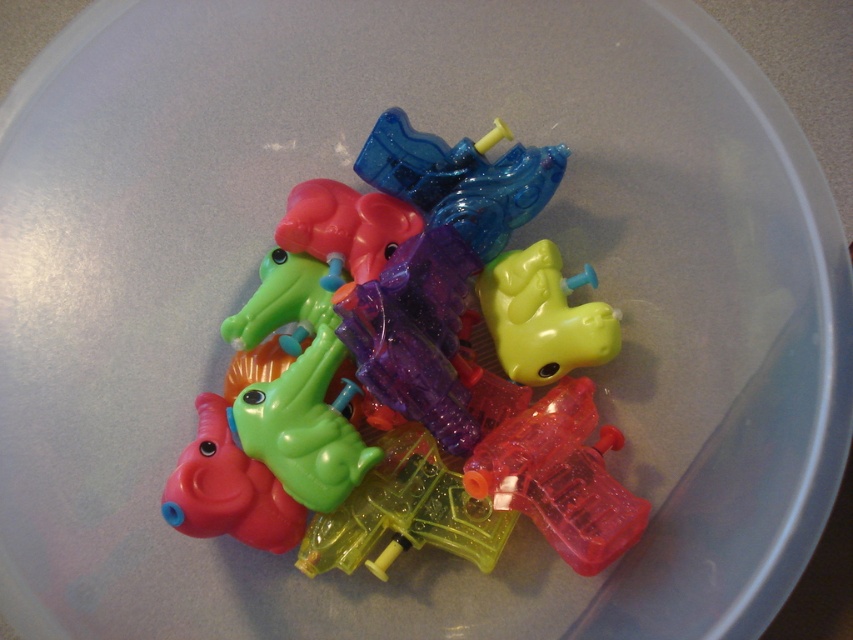
You have a small box that can only fit items up to 10 cm wide. You need to place either the translucent plastic toy at center or the transparent plastic gun at center inside it. Based on their sizes, which one can fit?

The transparent plastic gun at center can fit in the box since its width is smaller than the translucent plastic toy at center, and the box can hold items up to 10 cm wide.

You are a child who wants to reach the transparent plastic gun at center from where you are standing. The toys are arranged in a pile. Can you safely step over the pile of toys to reach the gun?

The distance between you and the transparent plastic gun at center is 1.22 meters. Since the pile of toys is part of the path, stepping over them might be possible if the child can manage the distance and height of the pile, but safety depends on the child maintaining balance and not tripping over the toys.

You have two toys in the center of a container, a translucent plastic toy at center and a rubberized green crocodile at center. Which toy is wider?

The translucent plastic toy at center is wider than the rubberized green crocodile at center according to the description.